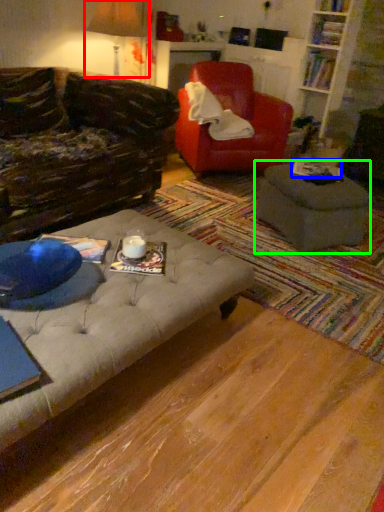
Question: Which object is the farthest from table lamp (highlighted by a red box)? Choose among these: book (highlighted by a blue box) or table (highlighted by a green box).

Choices:
 (A) book
 (B) table

Answer: (B)